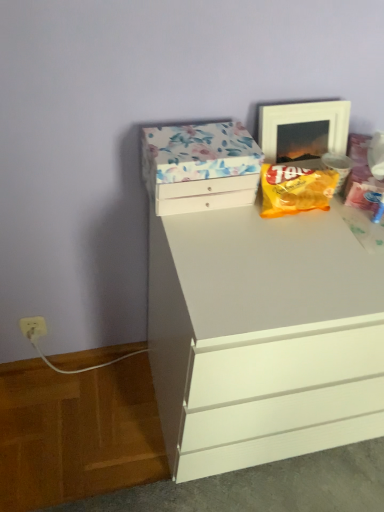
Locate an element on the screen. vacant area located to the right-hand side of floral paper-covered box at upper center is located at coordinates (281, 228).